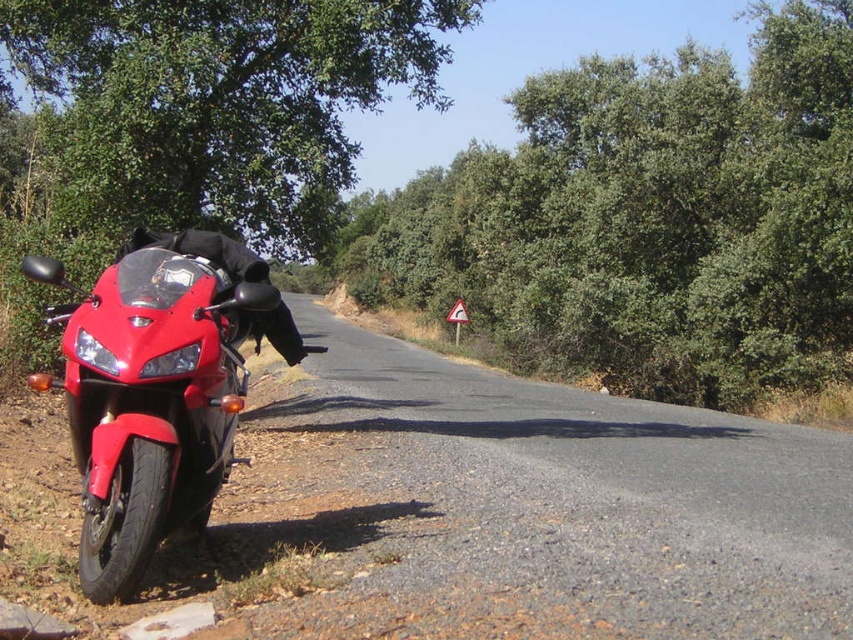
You are a photographer planning to take a wide shot of the scene. You need to ensure that both the green leafy tree at upper left and the glossy red motorcycle at left are fully visible in the frame. Which object requires more horizontal space in the composition?

The green leafy tree at upper left requires more horizontal space in the composition because its width surpasses that of the glossy red motorcycle at left.

You are a hiker trying to navigate through the area. You see the green leafy tree at center and the green leafy tree at upper left. Which tree would you use as a landmark for direction if you want to stay on the main road?

The green leafy tree at center is larger and closer to the road, making it a better landmark for staying on the main road compared to the smaller green leafy tree at upper left.

You are a hiker standing on the rural road next to the red motorcycle. You want to walk from the green leafy tree at upper left to the green leafy tree at center. How far will you have to walk?

The distance between the green leafy tree at center and the green leafy tree at upper left is 63.90 feet, so you will have to walk approximately 63.90 feet.